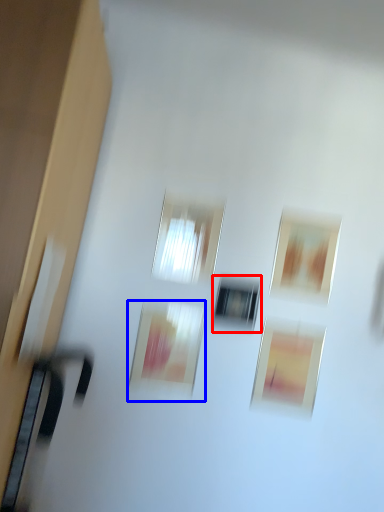
Question: Which object appears farthest to the camera in this image, window (highlighted by a red box) or picture frame (highlighted by a blue box)?

Choices:
 (A) window
 (B) picture frame

Answer: (A)